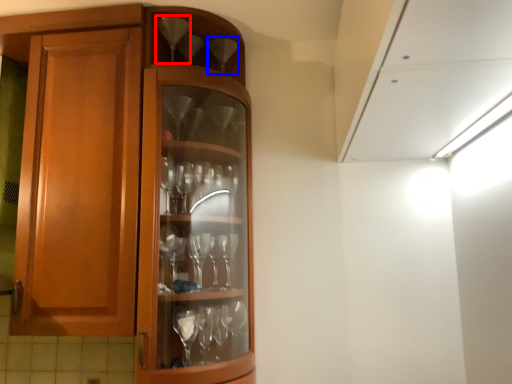
Question: Which object appears farthest to the camera in this image, wine glass (highlighted by a red box) or wine glass (highlighted by a blue box)?

Choices:
 (A) wine glass
 (B) wine glass

Answer: (B)